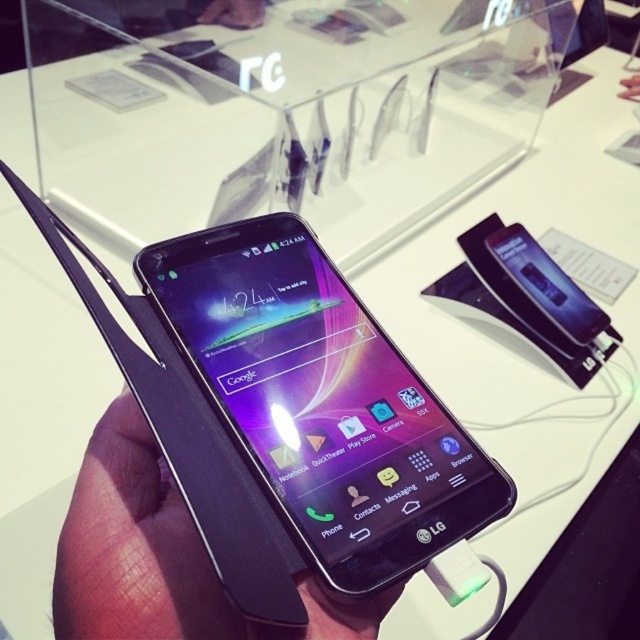
Is black glossy phone at center to the right of black matte phone at center from the viewer's perspective?

Indeed, black glossy phone at center is positioned on the right side of black matte phone at center.

Can you confirm if black glossy phone at center is taller than black matte phone at center?

Yes.

Describe the element at coordinates (321, 401) in the screenshot. I see `black glossy phone at center` at that location.

In order to click on black glossy phone at center in this screenshot , I will do `click(321, 401)`.